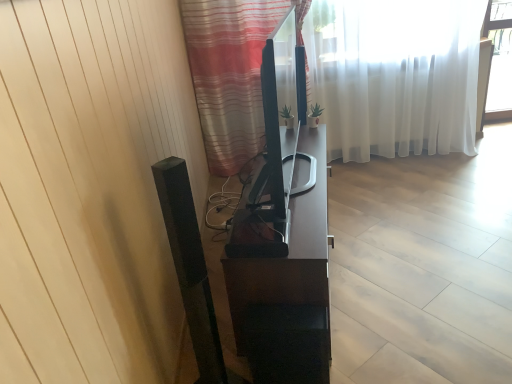
Identify the location of vacant space in between satin black tv stand at center and white sheer curtain at upper center, which ranks as the 2th curtain in front-to-back order. (386, 212).